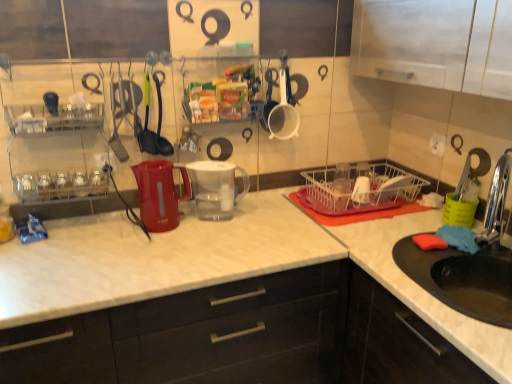
What are the coordinates of `blank space above clear plastic shelf at center (from a real-world perspective)` in the screenshot? It's located at (225, 73).